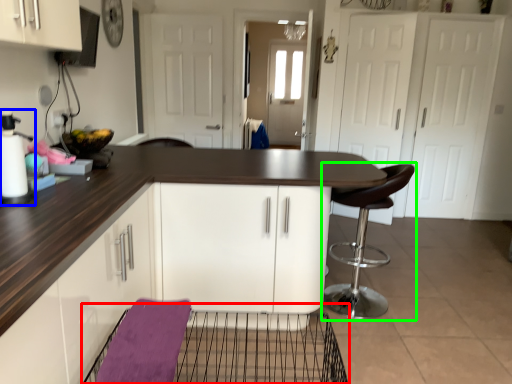
Question: Considering the real-world distances, which object is farthest from cage (highlighted by a red box)? appliance (highlighted by a blue box) or chair (highlighted by a green box)?

Choices:
 (A) appliance
 (B) chair

Answer: (A)